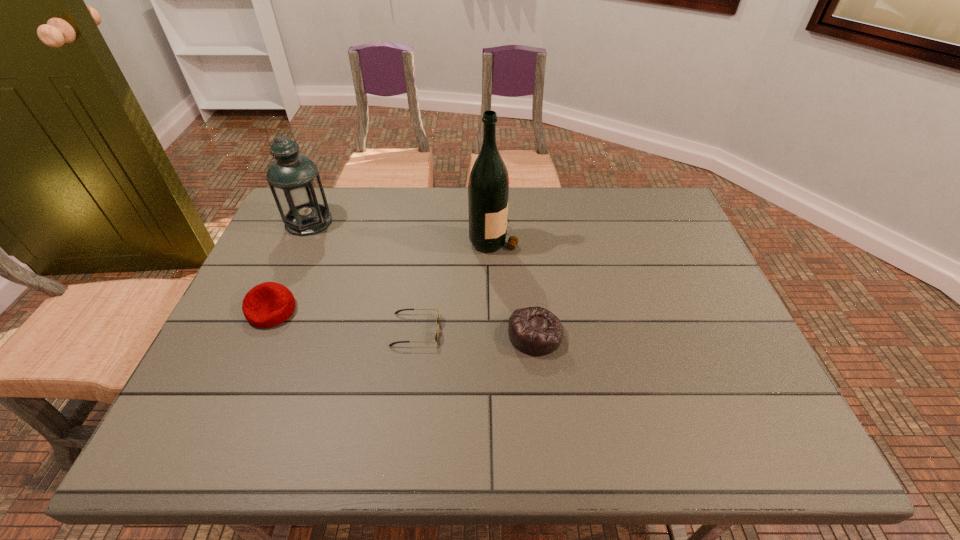
Where is `object that is the third closest to the left beanbag`? This screenshot has height=540, width=960. object that is the third closest to the left beanbag is located at coordinates (488, 188).

This screenshot has height=540, width=960. In order to click on object that stands as the second closest to the oil lamp in this screenshot , I will do `click(437, 321)`.

Image resolution: width=960 pixels, height=540 pixels. Identify the location of blank space that satisfies the following two spatial constraints: 1. on the front side of the oil lamp; 2. on the right side of the right beanbag. (259, 334).

You are a GUI agent. You are given a task and a screenshot of the screen. Output one action in this format:
    pyautogui.click(x=<x>, y=<y>)
    Task: Click on the vacant space that satisfies the following two spatial constraints: 1. on the front-facing side of the sunglasses; 2. on the right side of the right beanbag
    Image resolution: width=960 pixels, height=540 pixels.
    Given the screenshot: What is the action you would take?
    pyautogui.click(x=415, y=334)